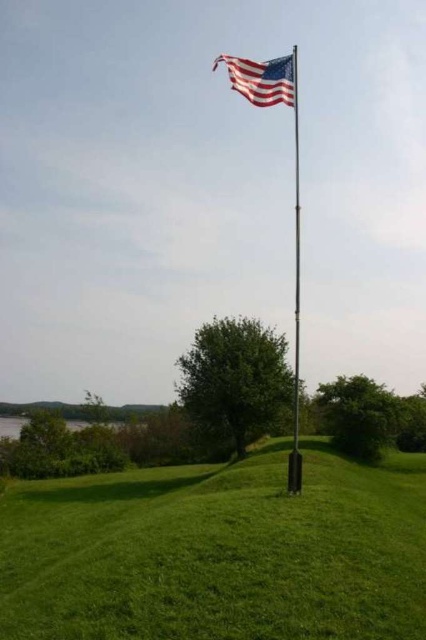
Who is more forward, (268,72) or (299,332)?

Point (268,72) is more forward.

Does american flag at upper center come behind metallic flag pole at center?

Yes.

Who is more forward, (291, 65) or (294, 257)?

Point (291, 65) is in front.

This screenshot has height=640, width=426. What are the coordinates of `american flag at upper center` in the screenshot? It's located at coord(261,77).

Who is positioned more to the left, green grass at center or metallic flag pole at center?

From the viewer's perspective, green grass at center appears more on the left side.

Describe the element at coordinates (218, 552) in the screenshot. I see `green grass at center` at that location.

This screenshot has height=640, width=426. Describe the element at coordinates (218, 552) in the screenshot. I see `green grass at center` at that location.

The height and width of the screenshot is (640, 426). Identify the location of green grass at center. (218, 552).

Does point (376, 531) come behind point (293, 90)?

No.

Is point (89, 609) closer to camera compared to point (256, 72)?

Yes, point (89, 609) is in front of point (256, 72).

Find the location of `green grass at center`. green grass at center is located at coordinates (x=218, y=552).